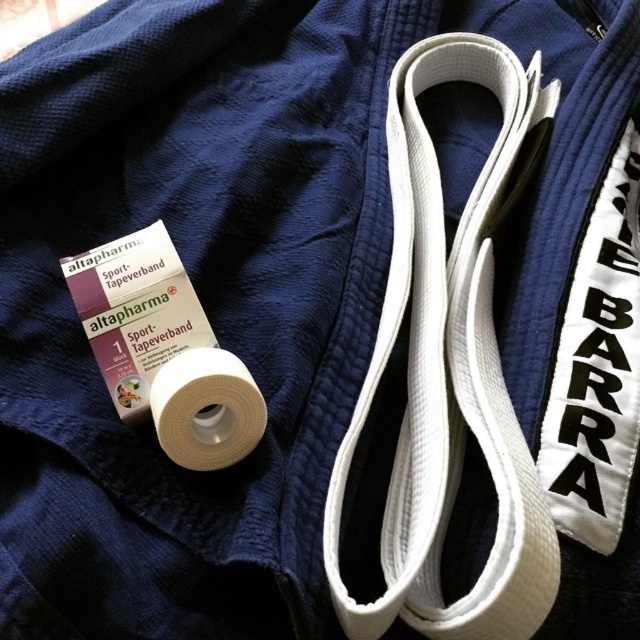
You are a photographer taking a close up shot of a martial arts uniform. You notice two points marked on the image. The first point is at coordinate point (436, 209) and the second point is at coordinate point (225, 352). Which point is closer to your camera lens?

Point (436, 209) is further to the camera than point (225, 352), so the first point is closer to the camera lens.

You are a martial arts instructor preparing for a class. You need to place the Altapharma Sport Tapeverband package on the table so that it is directly above the white fabric strap at center. According to the image, where should you position the package?

The Altapharma Sport Tapeverband package should be placed directly above the white fabric strap at center at the coordinates point [449,372].